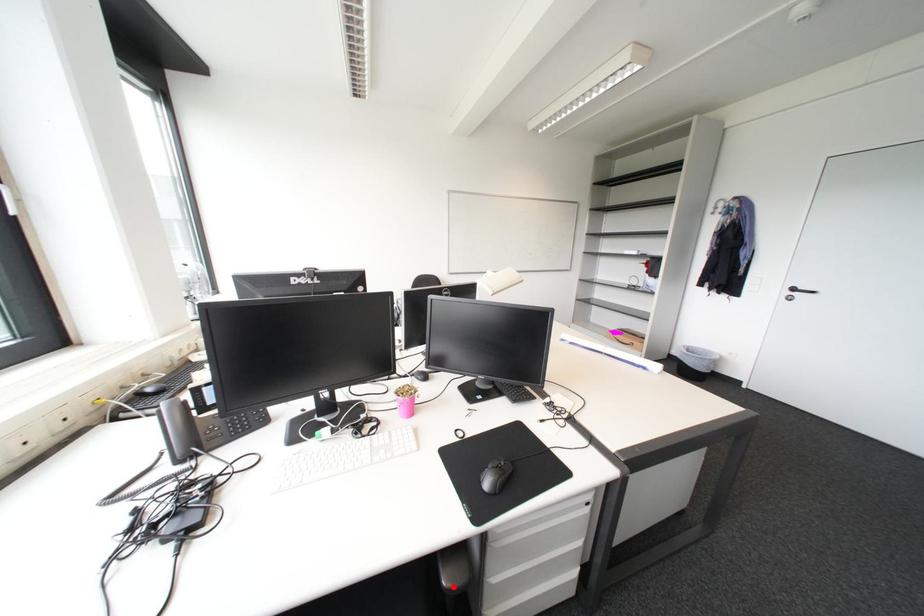
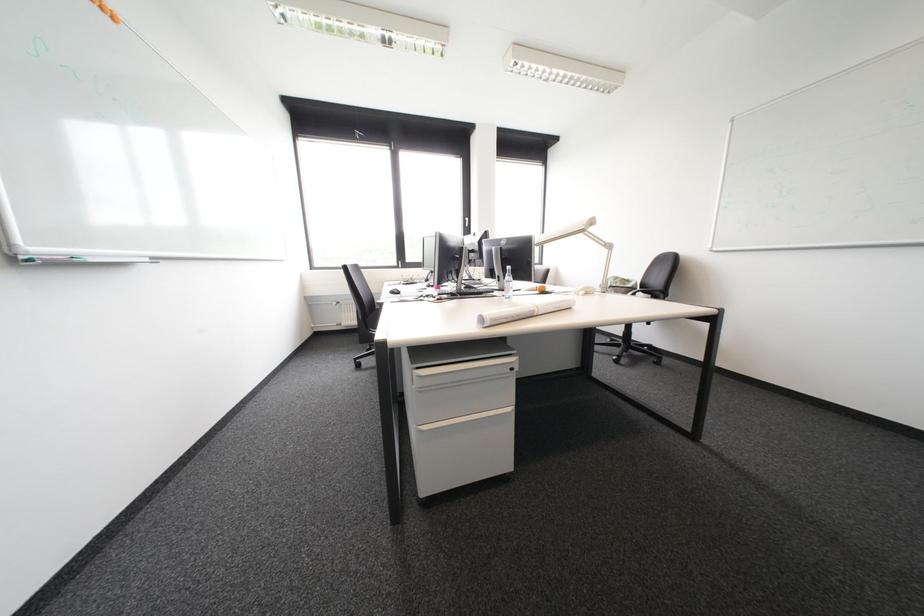
Question: I am providing you with two images of the same scene from different viewpoints. A red point is marked on the first image. At the location where the point appears in image 1, is it still visible in image 2?

Choices:
 (A) Yes
 (B) No

Answer: (B)